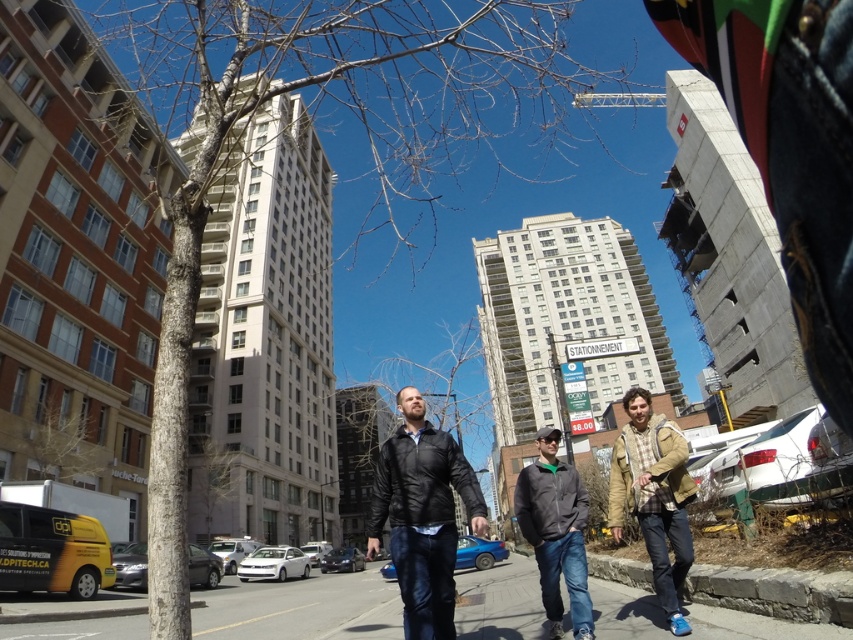
Question: Which object is farther from the camera taking this photo?

Choices:
 (A) dark gray jacket at center
 (B) gray concrete pavement at lower center
 (C) khaki plaid shirt at center
 (D) black leather jacket at center

Answer: (A)

Question: From the image, what is the correct spatial relationship of khaki plaid shirt at center in relation to dark gray jacket at center?

Choices:
 (A) right
 (B) left

Answer: (A)

Question: Can you confirm if gray concrete pavement at lower center is positioned to the left of dark gray jacket at center?

Choices:
 (A) no
 (B) yes

Answer: (B)

Question: Which object is positioned closest to the gray concrete pavement at lower center?

Choices:
 (A) black leather jacket at center
 (B) dark gray jacket at center
 (C) khaki plaid shirt at center

Answer: (A)

Question: Which point is closer to the camera?

Choices:
 (A) gray concrete pavement at lower center
 (B) black leather jacket at center
 (C) dark gray jacket at center

Answer: (A)

Question: Does black leather jacket at center have a smaller size compared to khaki plaid shirt at center?

Choices:
 (A) yes
 (B) no

Answer: (B)